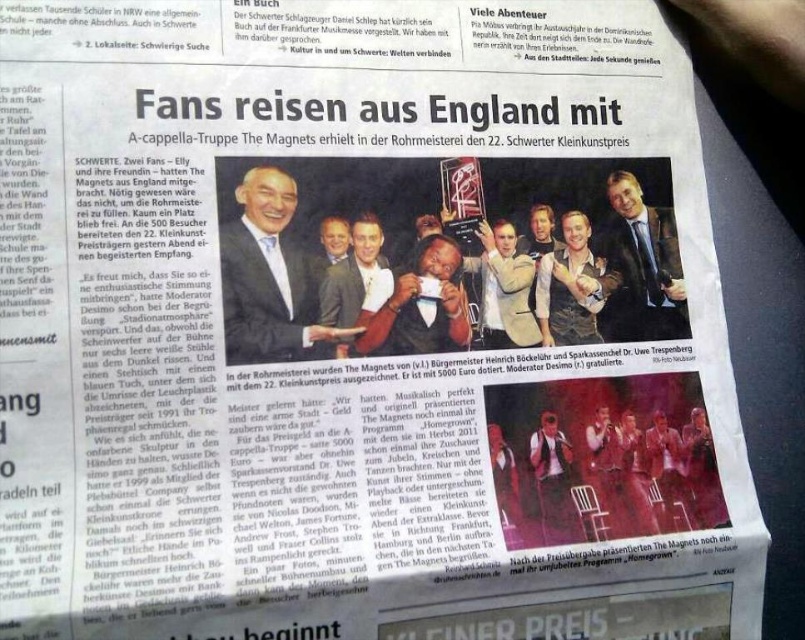
How far apart are matte black suit at upper right and light brown leather jacket at center?

matte black suit at upper right and light brown leather jacket at center are 3.39 centimeters apart.

Between matte black suit at upper right and light brown leather jacket at center, which one is positioned higher?

Positioned higher is matte black suit at upper right.

Who is more forward, (x=625, y=173) or (x=560, y=250)?

Positioned in front is point (x=560, y=250).

Where is `matte black suit at upper right`? This screenshot has height=640, width=805. matte black suit at upper right is located at coordinates (642, 266).

Which of these two, matte black suit at upper right or matte black sunglasses at center, stands taller?

matte black suit at upper right

Is point (657, 291) positioned in front of point (572, 500)?

No, (657, 291) is further to viewer.

At what (x,y) coordinates should I click in order to perform the action: click on matte black suit at upper right. Please return your answer as a coordinate pair (x, y). Image resolution: width=805 pixels, height=640 pixels. Looking at the image, I should click on (642, 266).

Who is more forward, (547, 323) or (324, 243)?

Point (324, 243) is in front.

Where is `light brown leather jacket at center`? light brown leather jacket at center is located at coordinates (568, 288).